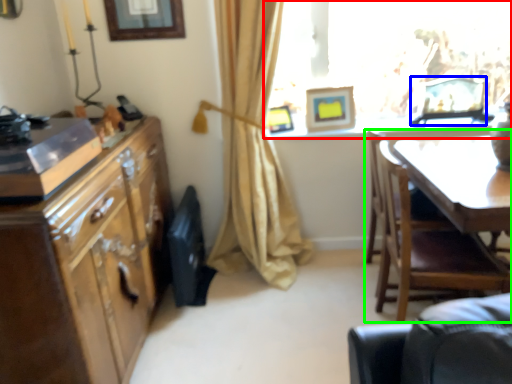
Question: Which object is the closest to the window (highlighted by a red box)? Choose among these: picture frame (highlighted by a blue box) or chair (highlighted by a green box).

Choices:
 (A) picture frame
 (B) chair

Answer: (A)